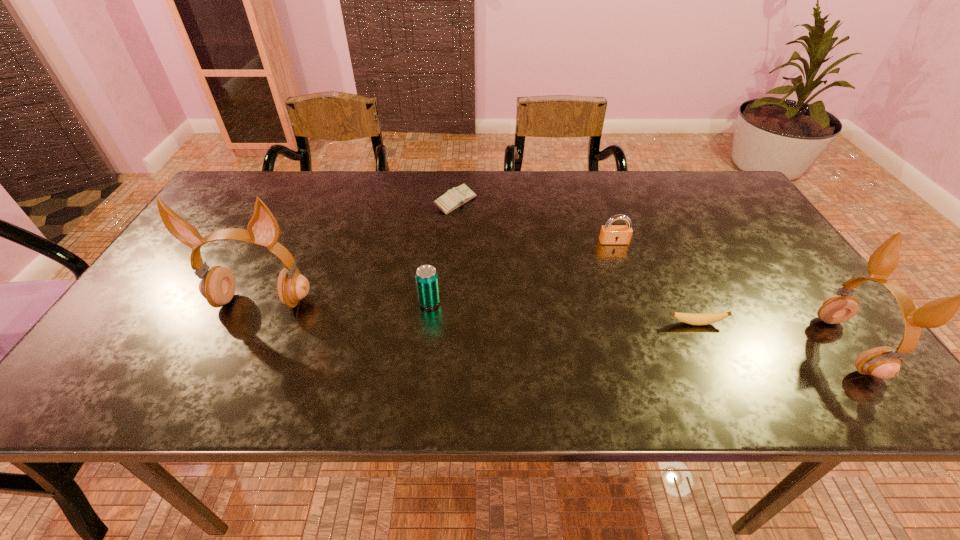
Where is `vacant space that's between the diary and the taller earphone`? The image size is (960, 540). vacant space that's between the diary and the taller earphone is located at coordinates (359, 252).

Find the location of `free space between the fifth object from left to right and the diary`. free space between the fifth object from left to right and the diary is located at coordinates (576, 262).

Where is `free space between the rightmost object and the second farthest object`? The height and width of the screenshot is (540, 960). free space between the rightmost object and the second farthest object is located at coordinates (731, 294).

Image resolution: width=960 pixels, height=540 pixels. I want to click on blank region between the beer can and the second object from right to left, so click(563, 313).

Where is `free point between the diary and the padlock`? free point between the diary and the padlock is located at coordinates (535, 222).

What are the coordinates of `object that can be found as the second closest to the fifth shortest object` in the screenshot? It's located at (610, 234).

Point out which object is positioned as the fifth nearest to the fifth object from left to right. Please provide its 2D coordinates. Your answer should be formatted as a tuple, i.e. [(x, y)], where the tuple contains the x and y coordinates of a point satisfying the conditions above.

[(217, 286)]